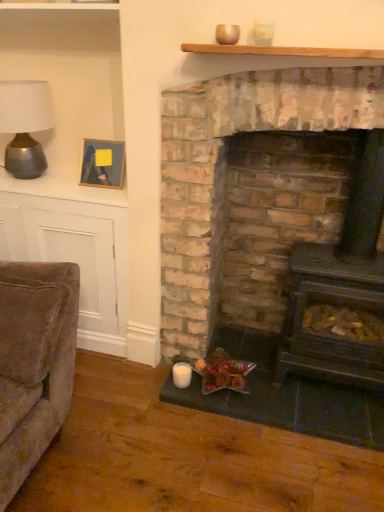
You are a GUI agent. You are given a task and a screenshot of the screen. Output one action in this format:
    pyautogui.click(x=<x>, y=<y>)
    Task: Click on the free space in front of shiny brown nuts at lower center
    This screenshot has width=384, height=512.
    Given the screenshot: What is the action you would take?
    pyautogui.click(x=239, y=407)